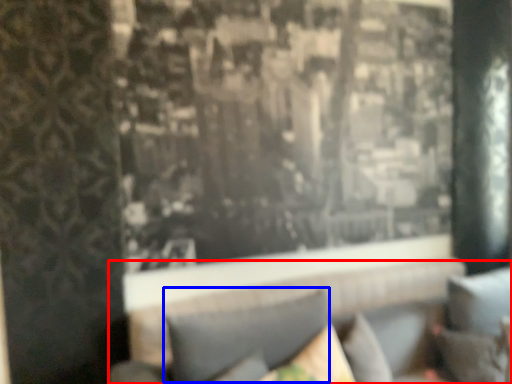
Question: Among these objects, which one is nearest to the camera, couch (highlighted by a red box) or pillow (highlighted by a blue box)?

Choices:
 (A) couch
 (B) pillow

Answer: (A)